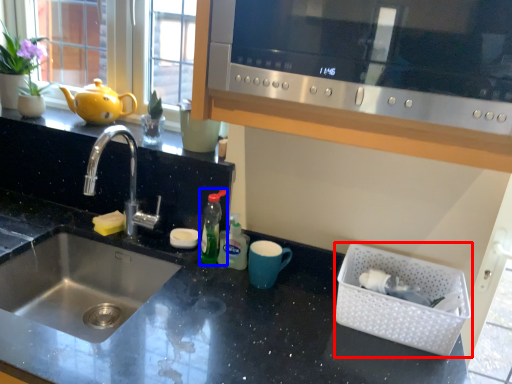
Question: Which object is further to the camera taking this photo, basket (highlighted by a red box) or bottle (highlighted by a blue box)?

Choices:
 (A) basket
 (B) bottle

Answer: (B)